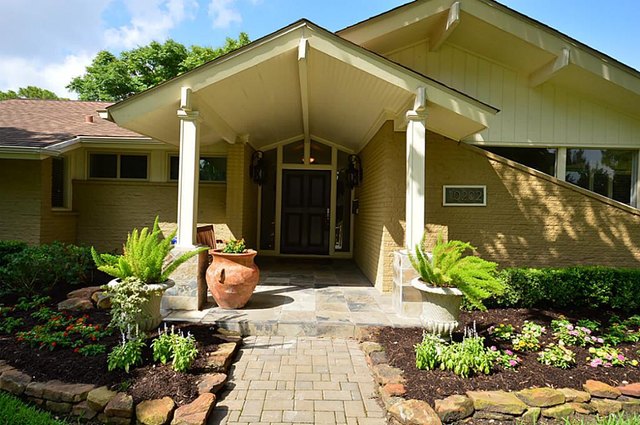
At what (x,y) coordinates should I click in order to perform the action: click on window. Please return your answer as a coordinate pair (x, y). Image resolution: width=640 pixels, height=425 pixels. Looking at the image, I should click on (621, 164), (534, 159), (219, 171), (138, 162), (114, 163).